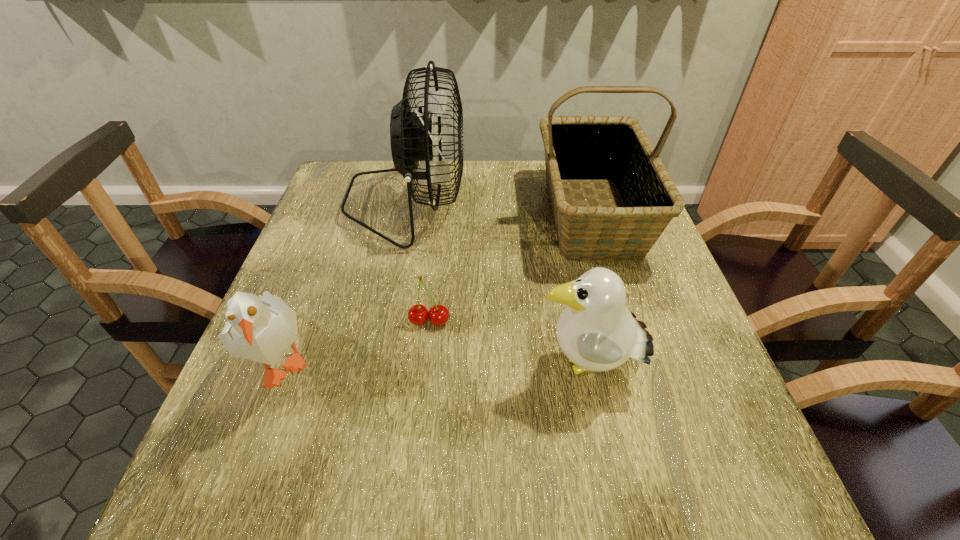
The image size is (960, 540). In order to click on fan in this screenshot , I will do `click(412, 138)`.

This screenshot has width=960, height=540. I want to click on basket, so pyautogui.click(x=578, y=149).

This screenshot has height=540, width=960. Identify the location of the left gull. (261, 329).

Find the location of a particular element. Image resolution: width=960 pixels, height=540 pixels. the right gull is located at coordinates (596, 331).

Where is `cherry`? cherry is located at coordinates (418, 314).

Where is `vacant space located 0.370m in front of the fan, directing airflow`? The image size is (960, 540). vacant space located 0.370m in front of the fan, directing airflow is located at coordinates (599, 204).

At what (x,y) coordinates should I click in order to perform the action: click on vacant position located 0.390m by the handle of the basket. Please return your answer as a coordinate pair (x, y). Looking at the image, I should click on (659, 435).

Where is `vacant space located 0.140m at the beak of the left gull`? This screenshot has height=540, width=960. vacant space located 0.140m at the beak of the left gull is located at coordinates [226, 515].

Identify the location of blank space located 0.150m on the beak of the right gull. (455, 368).

Locate an element on the screen. This screenshot has height=540, width=960. vacant space located on the beak of the right gull is located at coordinates (402, 368).